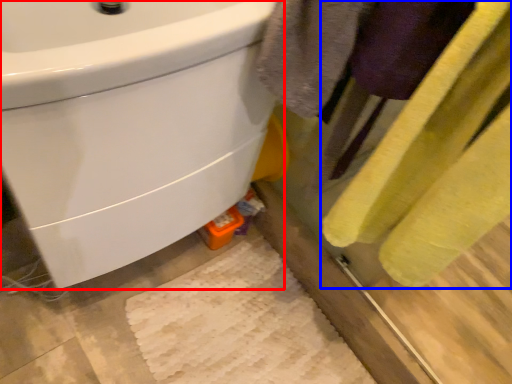
Question: Which object appears closest to the camera in this image, sink (highlighted by a red box) or bath towel (highlighted by a blue box)?

Choices:
 (A) sink
 (B) bath towel

Answer: (B)